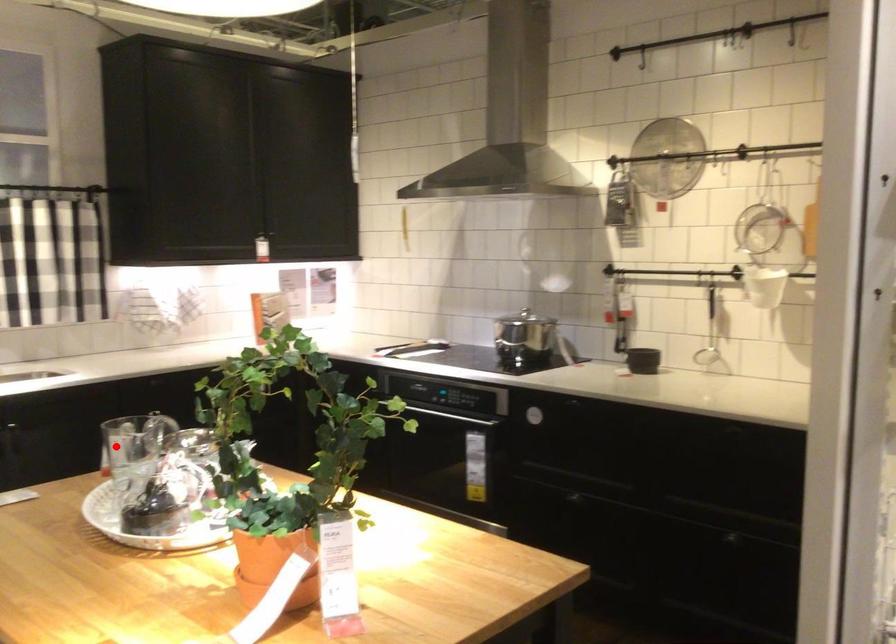
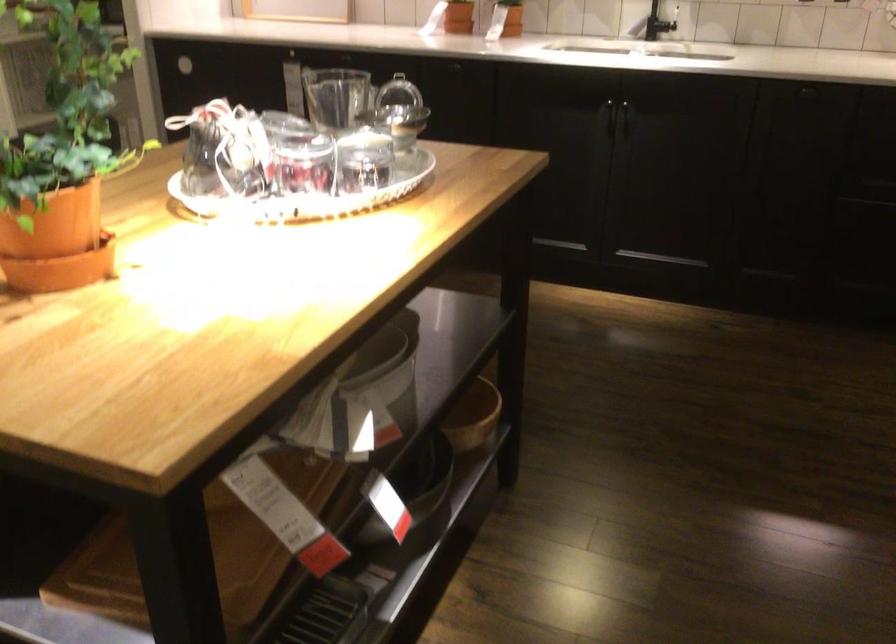
Question: I am providing you with two images of the same scene from different viewpoints. Given a red point in image1, look at the same physical point in image2. Is it:

Choices:
 (A) Closer to the viewpoint
 (B) Farther from the viewpoint

Answer: (A)